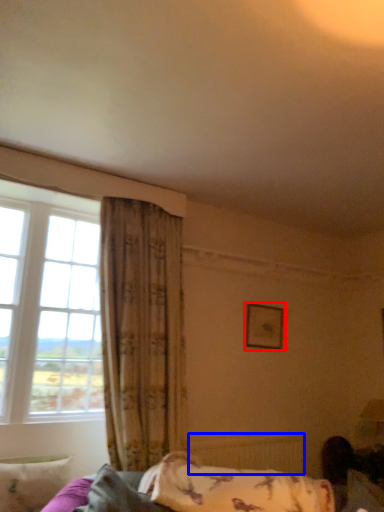
Question: Which object appears farthest to the camera in this image, picture frame (highlighted by a red box) or radiator (highlighted by a blue box)?

Choices:
 (A) picture frame
 (B) radiator

Answer: (A)